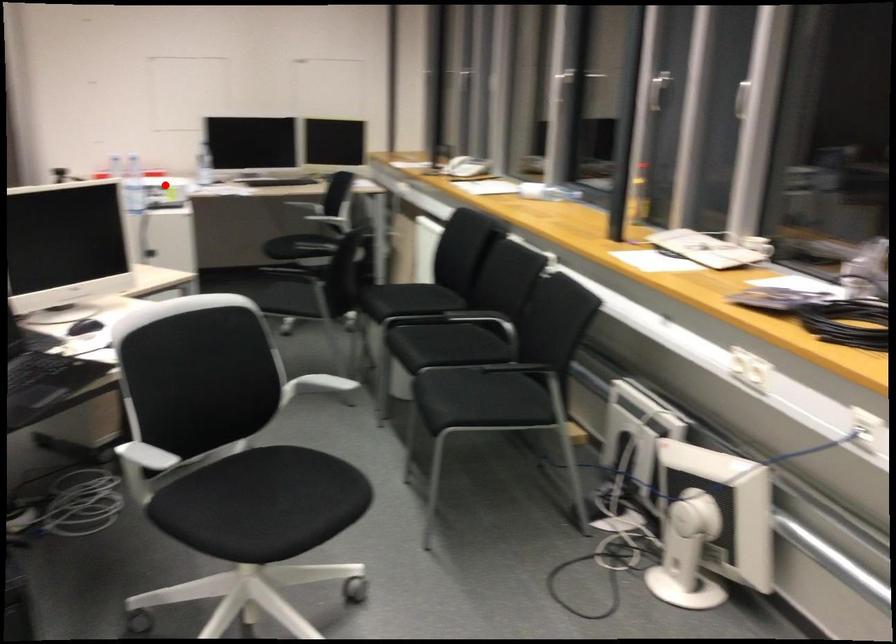
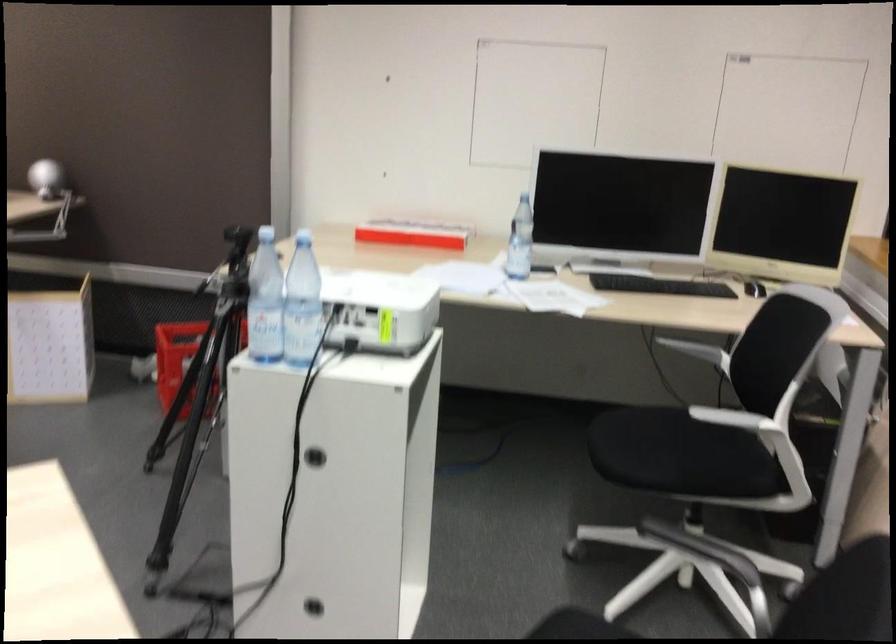
Find the pixel in the second image that matches the highlighted location in the first image.

(380, 308)